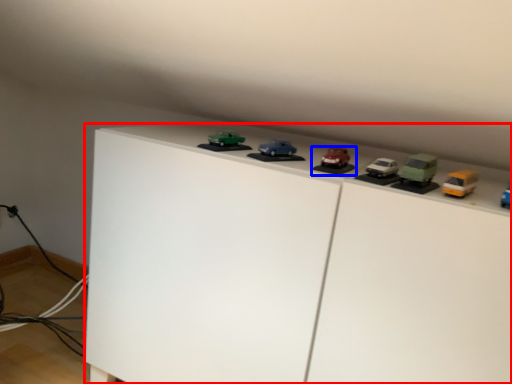
Question: Which object is further to the camera taking this photo, furniture (highlighted by a red box) or toy (highlighted by a blue box)?

Choices:
 (A) furniture
 (B) toy

Answer: (B)